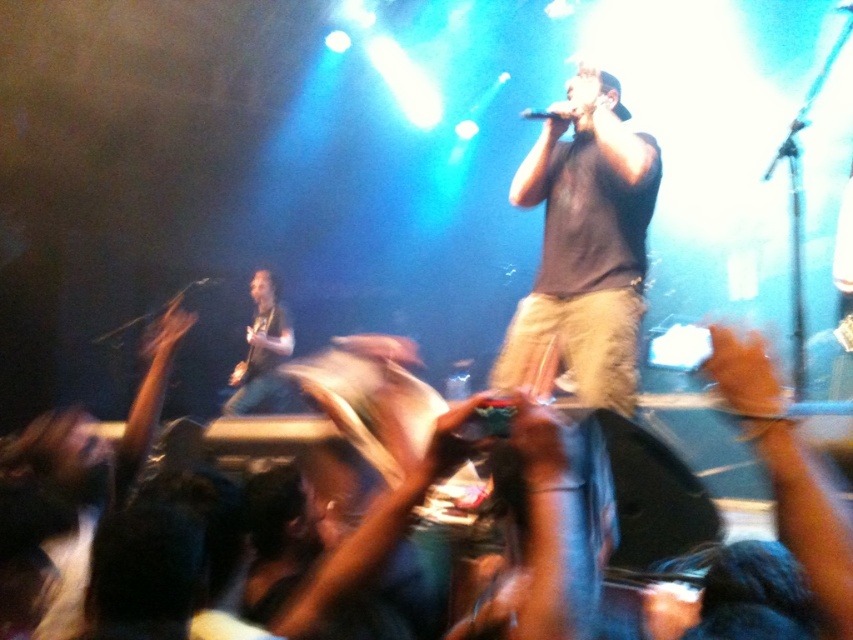
Between point (614, 212) and point (219, 276), which one is positioned behind?

Positioned behind is point (219, 276).

Can you confirm if black cotton shirt at center is positioned to the left of black matte microphone at center?

No, black cotton shirt at center is not to the left of black matte microphone at center.

I want to click on black cotton shirt at center, so click(x=584, y=248).

Is point (628, 307) in front of point (525, 109)?

Yes, it is in front of point (525, 109).

Is black cotton shirt at center shorter than black matte microphone at upper center?

No.

Where is `black cotton shirt at center`? The width and height of the screenshot is (853, 640). black cotton shirt at center is located at coordinates (584, 248).

At what (x,y) coordinates should I click in order to perform the action: click on black cotton shirt at center. Please return your answer as a coordinate pair (x, y). Looking at the image, I should click on click(584, 248).

Is black matte microphone at upper center in front of black matte microphone at center?

That is True.

Find the location of a particular element. The width and height of the screenshot is (853, 640). black matte microphone at upper center is located at coordinates (538, 115).